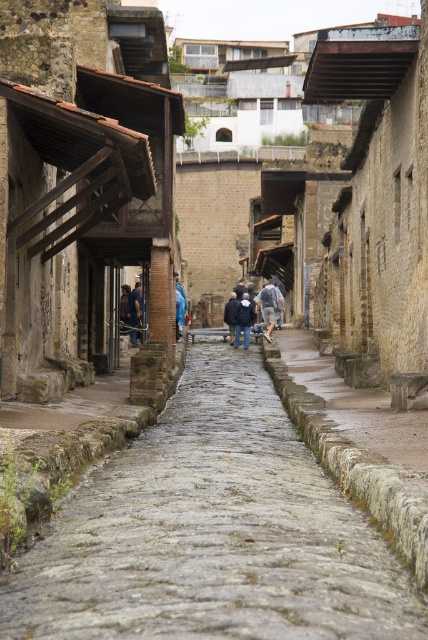
Does gray stone pavement at center have a smaller size compared to dark blue fabric coat at center?

Correct, gray stone pavement at center occupies less space than dark blue fabric coat at center.

From the picture: Does gray stone pavement at center have a larger size compared to dark blue fabric coat at center?

Incorrect, gray stone pavement at center is not larger than dark blue fabric coat at center.

Between point (383, 547) and point (240, 321), which one is positioned in front?

Positioned in front is point (383, 547).

This screenshot has width=428, height=640. I want to click on gray stone pavement at center, so click(x=211, y=532).

From the picture: Who is higher up, stone cobblestone path at center or denim jacket at center?

denim jacket at center is above.

In the scene shown: Is stone cobblestone path at center in front of denim jacket at center?

Yes, it is.

Is point (338, 385) farther from camera compared to point (265, 289)?

No, it is in front of (265, 289).

Identify the location of stone cobblestone path at center. (356, 404).

Is dark blue fabric coat at center smaller than dark blue fabric jacket at center?

Incorrect, dark blue fabric coat at center is not smaller in size than dark blue fabric jacket at center.

Between point (247, 308) and point (235, 320), which one is positioned in front?

Positioned in front is point (247, 308).

Does point (275, 289) come behind point (247, 298)?

Yes, it is.

Image resolution: width=428 pixels, height=640 pixels. Identify the location of dark blue fabric coat at center. (269, 307).